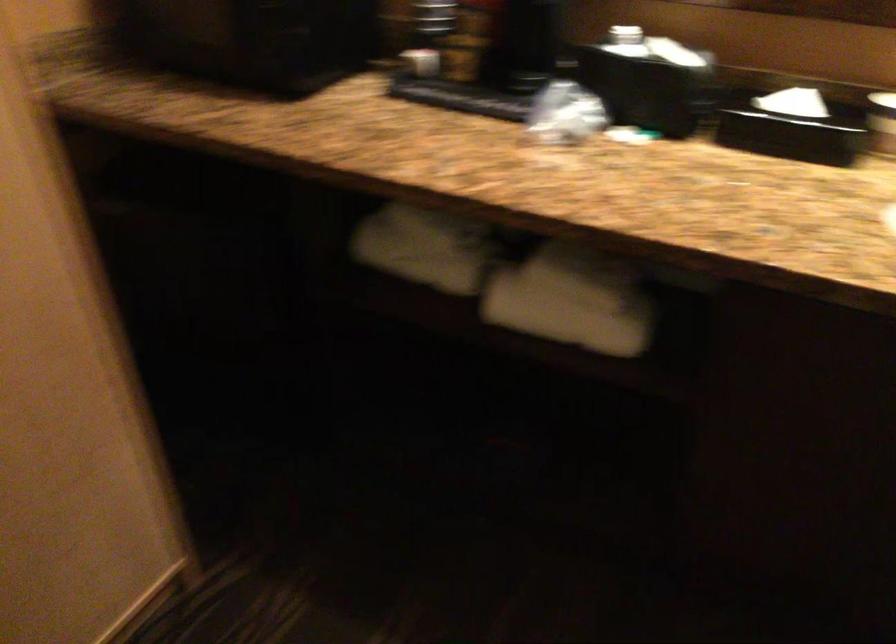
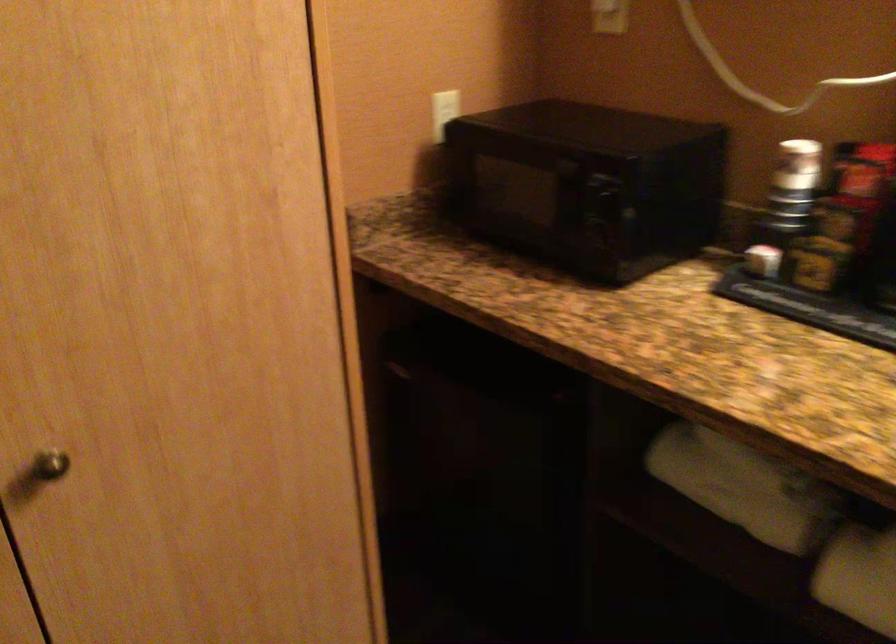
What movement of the cameraman would produce the second image?

The cameraman walked toward left, forward.